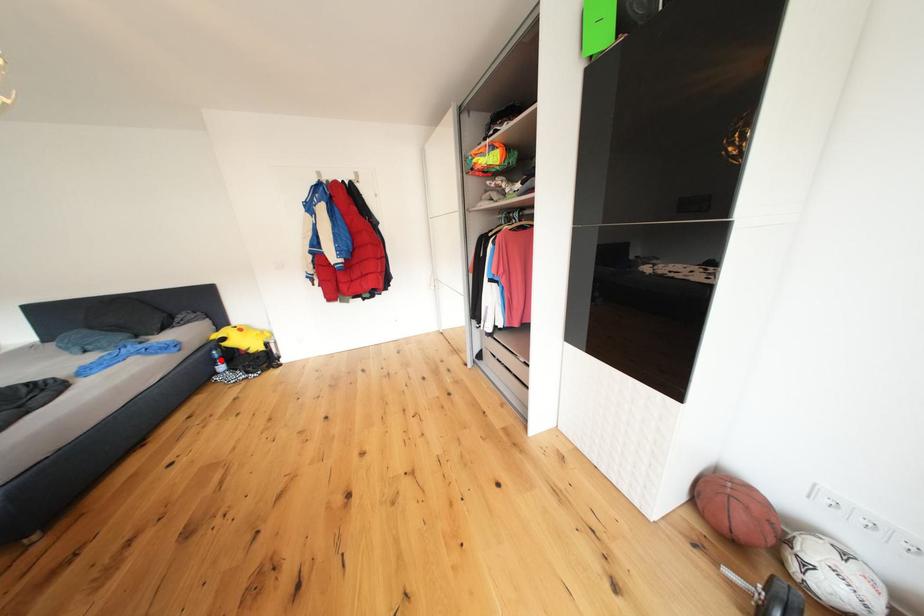
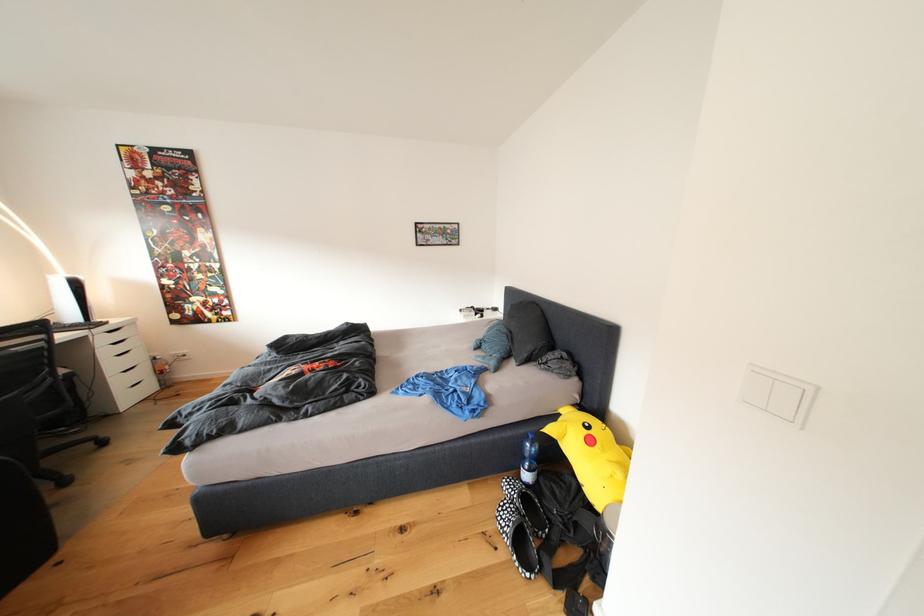
Question: A red point is marked in image1. In image2, is the corresponding 3D point closer to the camera or farther? Reply with the corresponding letter.

Choices:
 (A) The corresponding 3D point is closer.
 (B) The corresponding 3D point is farther.

Answer: (B)